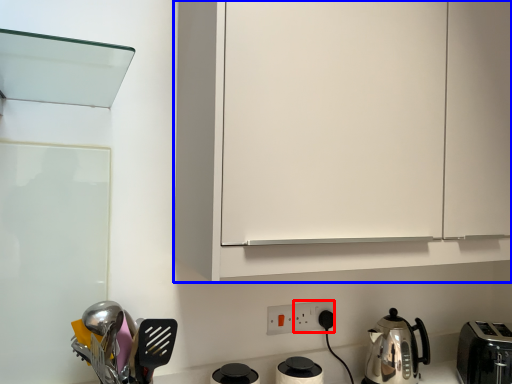
Question: Which object appears closest to the camera in this image, electric outlet (highlighted by a red box) or cabinetry (highlighted by a blue box)?

Choices:
 (A) electric outlet
 (B) cabinetry

Answer: (B)